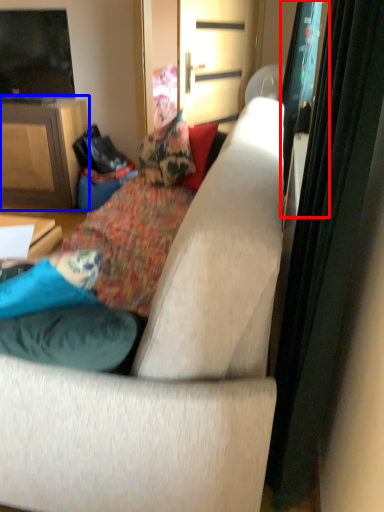
Question: Which of the following is the closest to the observer, screen door (highlighted by a red box) or cabinetry (highlighted by a blue box)?

Choices:
 (A) screen door
 (B) cabinetry

Answer: (A)